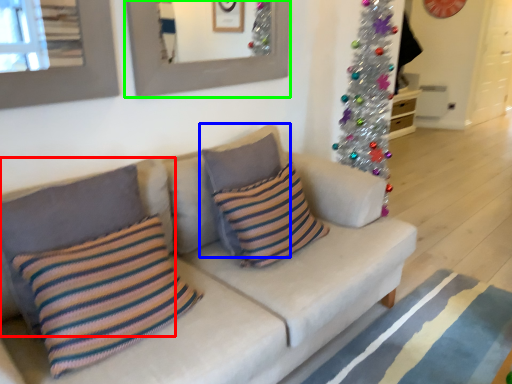
Question: Estimate the real-world distances between objects in this image. Which object is farther from pillow (highlighted by a red box), pillow (highlighted by a blue box) or picture frame (highlighted by a green box)?

Choices:
 (A) pillow
 (B) picture frame

Answer: (B)